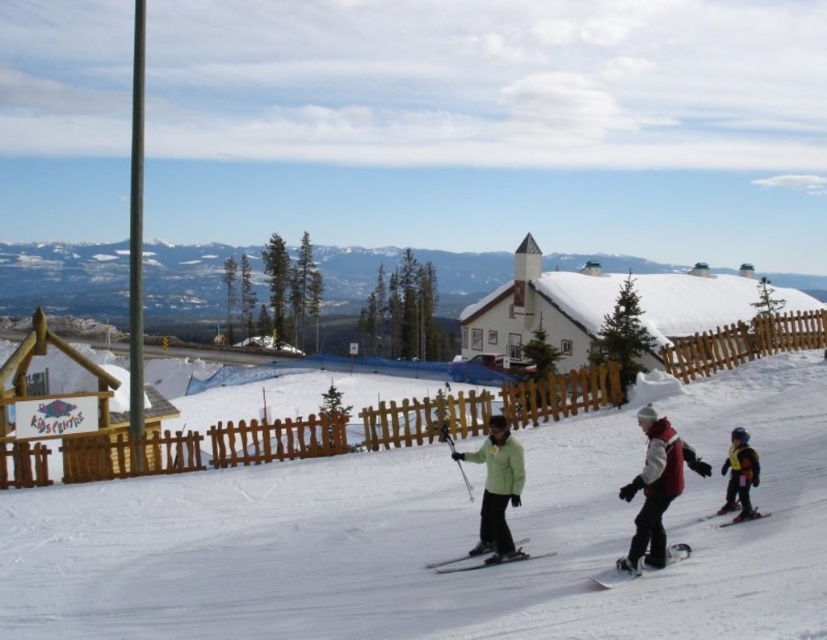
Consider the image. Does white snow at center have a lesser height compared to yellow life vest at lower right?

No.

Which of these two, white snow at center or yellow life vest at lower right, stands shorter?

Standing shorter between the two is yellow life vest at lower right.

Which is behind, point (407, 598) or point (747, 460)?

The point (747, 460) is behind.

Identify the location of white snow at center. This screenshot has height=640, width=827. (x=436, y=540).

Between white snow at center and black matte ski at center, which one appears on the left side from the viewer's perspective?

black matte ski at center is more to the left.

Is white snow at center closer to camera compared to black matte ski at center?

Yes, white snow at center is closer to the viewer.

Who is more forward, (667, 410) or (505, 561)?

Point (505, 561) is more forward.

Find the location of a particular element. white snow at center is located at coordinates (436, 540).

Does green matte jacket at center have a greater height compared to black matte ski at lower right?

Correct, green matte jacket at center is much taller as black matte ski at lower right.

Can you confirm if green matte jacket at center is thinner than black matte ski at lower right?

In fact, green matte jacket at center might be wider than black matte ski at lower right.

Which is in front, point (490, 513) or point (725, 512)?

Point (490, 513) is in front.

Locate an element on the screen. The width and height of the screenshot is (827, 640). green matte jacket at center is located at coordinates (x=496, y=490).